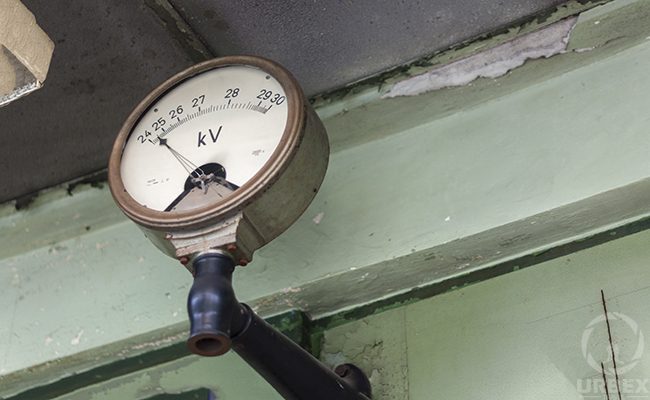
This screenshot has width=650, height=400. I want to click on ceiling, so (329, 34).